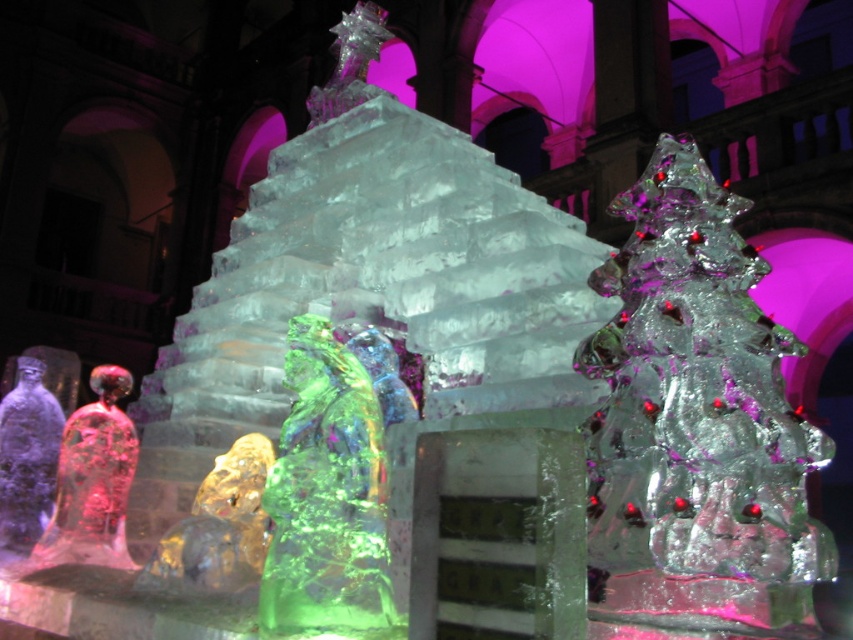
You are an artist planning to place a new ice sculpture of a snowman next to the translucent amber bear at center. Based on the coordinates provided, where should the snowman be placed to ensure it is positioned to the right of the bear?

The translucent amber bear at center is located at point (x=218, y=529). To place the snowman to the right of it, the snowman should be positioned at a coordinate with an x value greater than 0.827 while maintaining the same y value of 0.256.

You are standing in front of the ice sculpture installation. You see the transparent ice christmas tree at center and the green translucent ice sculpture at center. Which one is positioned to the right side?

The transparent ice christmas tree at center is positioned to the right of the green translucent ice sculpture at center, so the transparent ice christmas tree at center is on the right side.

Looking at this image, you are standing in front of the ice sculpture installation and want to take a photo. You notice two points marked in the image. The first point is at coordinate point (178, 556) and the second is at point (25, 458). Which point is closer to your camera lens when taking the photo?

Point (178, 556) is closer to the camera than point (25, 458).